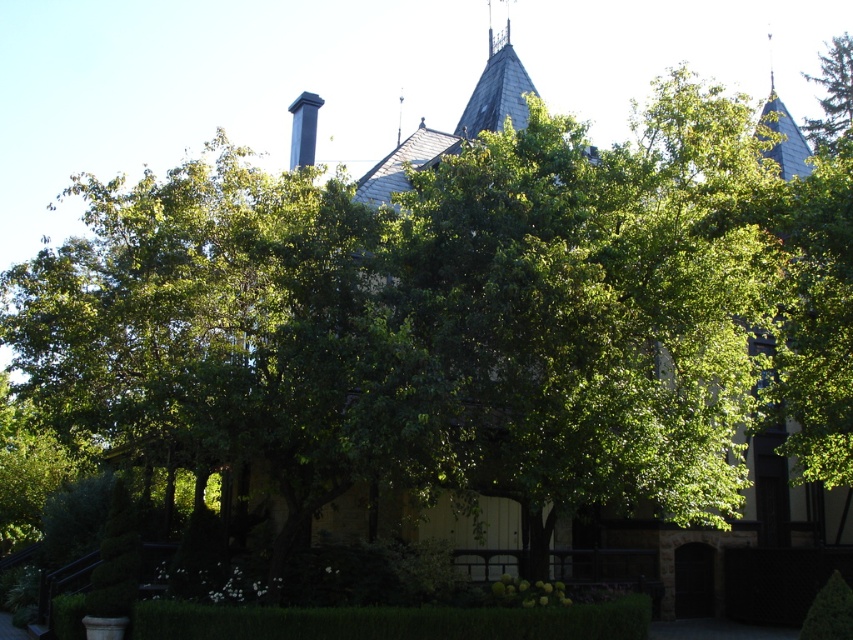
Question: Is dark gray slate chimney at upper center wider than green leafy tree at upper right?

Choices:
 (A) yes
 (B) no

Answer: (B)

Question: Which point is closer to the camera?

Choices:
 (A) (485, 120)
 (B) (810, 124)

Answer: (A)

Question: Can you confirm if dark gray slate chimney at upper center is positioned below green leafy tree at upper right?

Choices:
 (A) no
 (B) yes

Answer: (A)

Question: Does dark gray slate chimney at upper center appear on the left side of green leafy tree at upper right?

Choices:
 (A) no
 (B) yes

Answer: (B)

Question: Among these objects, which one is farthest from the camera?

Choices:
 (A) green leafy tree at upper right
 (B) dark gray slate chimney at upper center

Answer: (A)